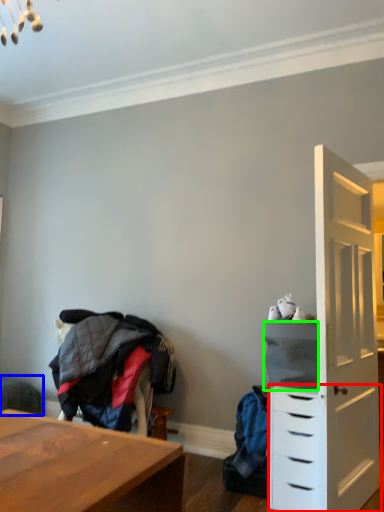
Question: Which object is positioned farthest from chest of drawers (highlighted by a red box)? Select from swivel chair (highlighted by a blue box) and cabinetry (highlighted by a green box).

Choices:
 (A) swivel chair
 (B) cabinetry

Answer: (A)